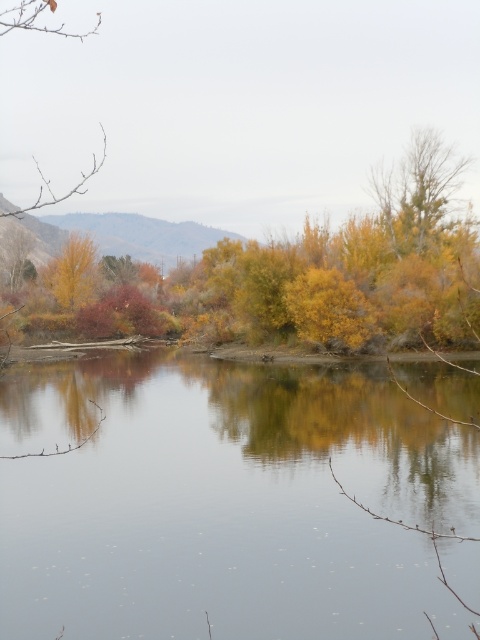
Does transparent water at center appear over yellow matte tree at upper left?

No.

Is the position of transparent water at center more distant than that of yellow matte tree at upper left?

No, it is not.

At what (x,y) coordinates should I click in order to perform the action: click on transparent water at center. Please return your answer as a coordinate pair (x, y). The width and height of the screenshot is (480, 640). Looking at the image, I should click on (226, 500).

This screenshot has width=480, height=640. I want to click on transparent water at center, so pyautogui.click(x=226, y=500).